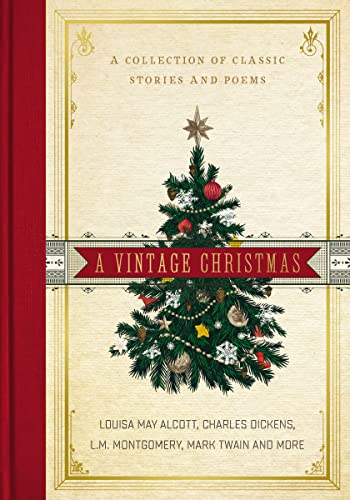
You are a GUI agent. You are given a task and a screenshot of the screen. Output one action in this format:
    pyautogui.click(x=<x>, y=<y>)
    Task: Click on the christmas tree branches with green leaves
    This screenshot has height=500, width=350.
    Given the screenshot: What is the action you would take?
    click(215, 366), click(198, 182), click(171, 224), click(141, 289), click(268, 353)